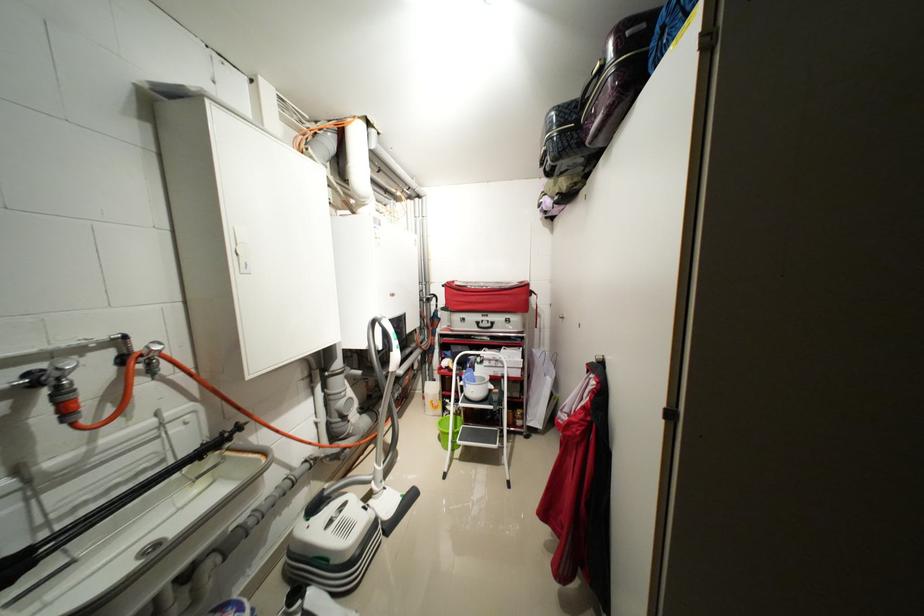
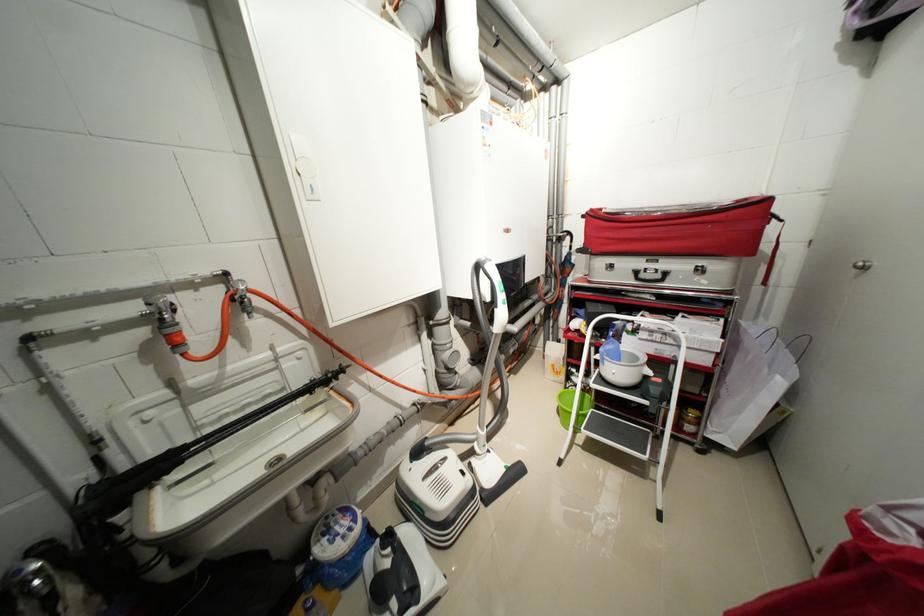
Question: I am providing you with two images of the same scene from different viewpoints. Please identify which objects are invisible in image2.

Choices:
 (A) white bowl
 (B) silver valve knob
 (C) red bag handle
 (D) none of these

Answer: (D)